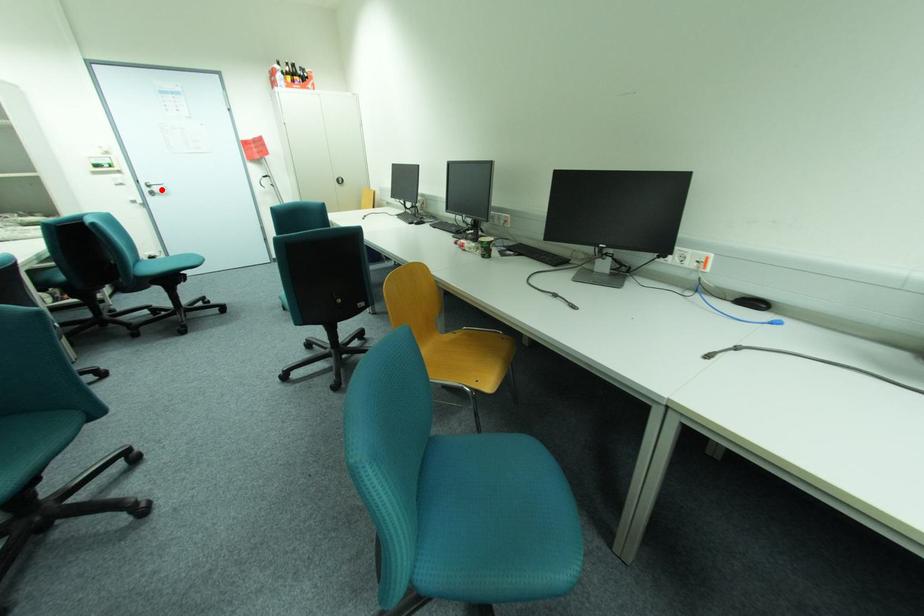
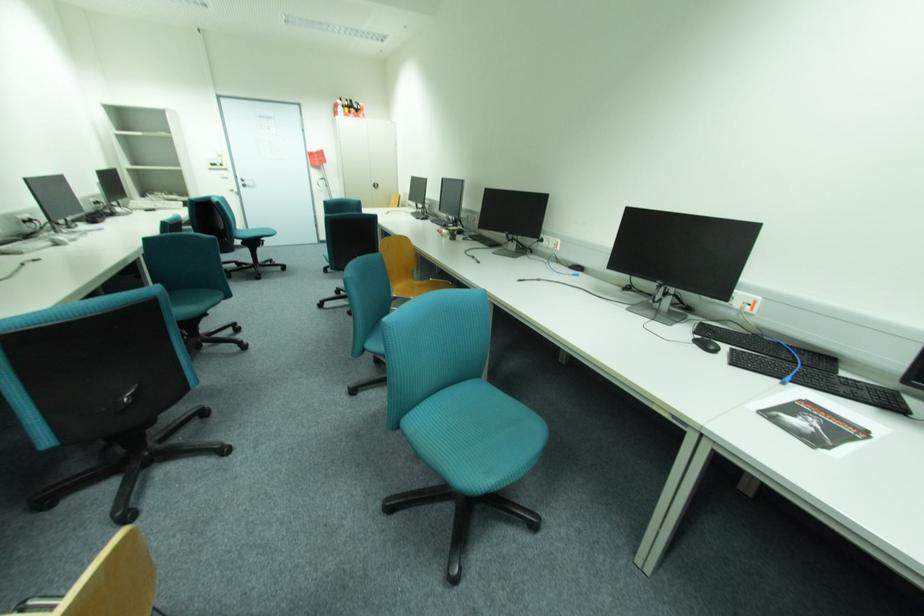
Where in the second image is the point corresponding to the highlighted location from the first image?

(253, 183)